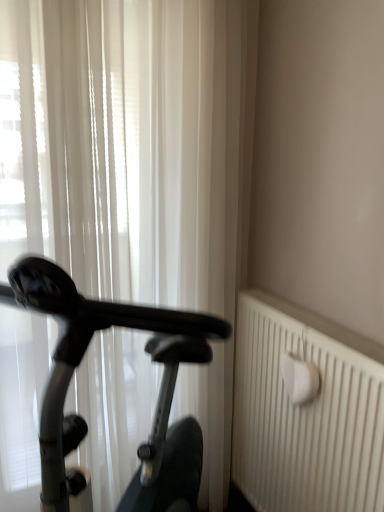
Question: Is white textured radiator at right at the left side of black glossy exercise bike at left?

Choices:
 (A) yes
 (B) no

Answer: (B)

Question: Can you confirm if white textured radiator at right is shorter than black glossy exercise bike at left?

Choices:
 (A) yes
 (B) no

Answer: (A)

Question: Considering the relative sizes of white textured radiator at right and black glossy exercise bike at left in the image provided, is white textured radiator at right wider than black glossy exercise bike at left?

Choices:
 (A) no
 (B) yes

Answer: (A)

Question: From the image's perspective, is white textured radiator at right beneath black glossy exercise bike at left?

Choices:
 (A) yes
 (B) no

Answer: (A)

Question: Does white textured radiator at right have a larger size compared to black glossy exercise bike at left?

Choices:
 (A) no
 (B) yes

Answer: (A)

Question: Is white textured radiator at right facing towards black glossy exercise bike at left?

Choices:
 (A) no
 (B) yes

Answer: (B)

Question: Considering the relative positions of white sheer curtain at left and black glossy exercise bike at left in the image provided, is white sheer curtain at left to the right of black glossy exercise bike at left from the viewer's perspective?

Choices:
 (A) no
 (B) yes

Answer: (A)

Question: Is white sheer curtain at left not inside black glossy exercise bike at left?

Choices:
 (A) no
 (B) yes

Answer: (B)

Question: Considering the relative sizes of white sheer curtain at left and black glossy exercise bike at left in the image provided, is white sheer curtain at left smaller than black glossy exercise bike at left?

Choices:
 (A) yes
 (B) no

Answer: (A)

Question: Is white sheer curtain at left thinner than black glossy exercise bike at left?

Choices:
 (A) no
 (B) yes

Answer: (B)

Question: From a real-world perspective, does white sheer curtain at left stand above black glossy exercise bike at left?

Choices:
 (A) yes
 (B) no

Answer: (A)

Question: Is black glossy exercise bike at left a part of white sheer curtain at left?

Choices:
 (A) no
 (B) yes

Answer: (A)

Question: Is black glossy exercise bike at left smaller than white sheer curtain at left?

Choices:
 (A) yes
 (B) no

Answer: (B)